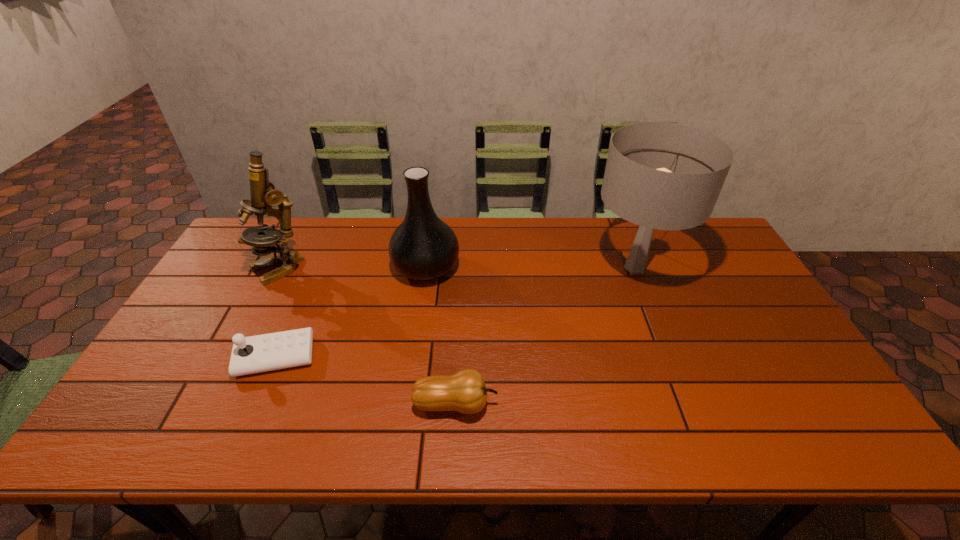
I want to click on free spot located on the right of the second nearest object, so click(x=335, y=357).

Where is `free space located on the stem side of the nearest object`? The image size is (960, 540). free space located on the stem side of the nearest object is located at coordinates (594, 404).

Find the location of a particular element. lampshade located in the far edge section of the desktop is located at coordinates (659, 175).

Locate an element on the screen. microscope present at the far edge is located at coordinates (263, 194).

Identify the location of vase that is at the far edge. (423, 247).

Locate an element on the screen. This screenshot has width=960, height=540. object present at the near edge is located at coordinates (465, 391).

Identify the location of object that is positioned at the left edge. (263, 194).

Where is `object that is at the far left corner`? object that is at the far left corner is located at coordinates (263, 194).

In the image, there is a desktop. Where is `vacant space at the far edge`? vacant space at the far edge is located at coordinates (340, 225).

Image resolution: width=960 pixels, height=540 pixels. Find the location of `vacant space at the near edge of the desktop`. vacant space at the near edge of the desktop is located at coordinates (336, 439).